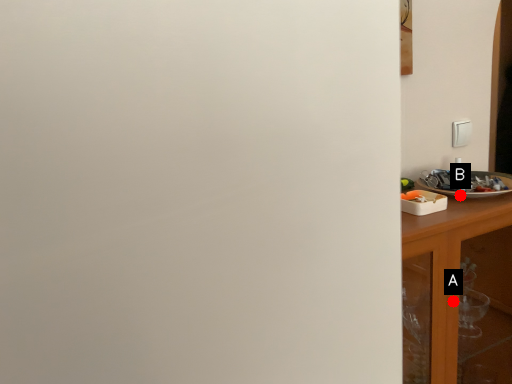
Question: Two points are circled on the image, labeled by A and B beside each circle. Which point is farther to the camera?

Choices:
 (A) A is further
 (B) B is further

Answer: (B)